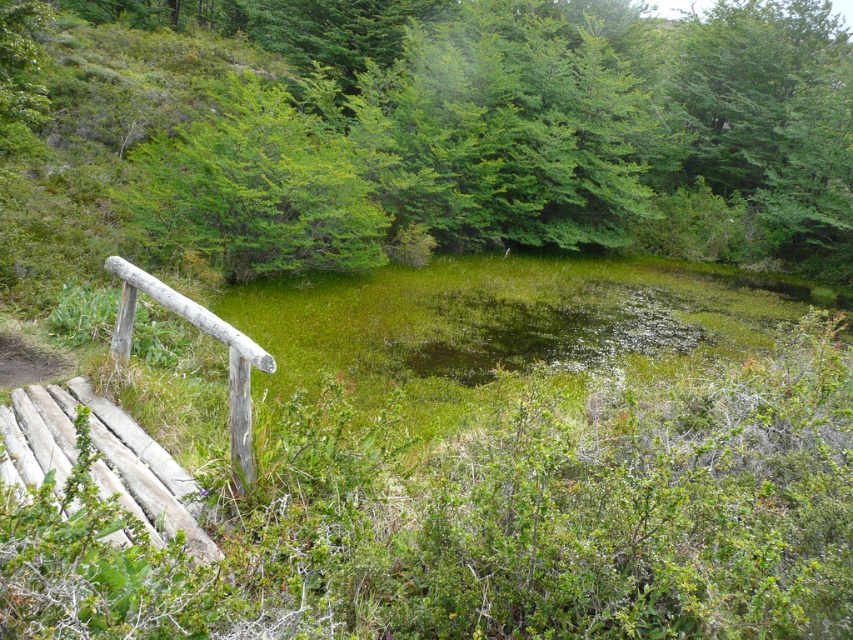
You are a hiker who wants to take a photo of the green leafy tree at upper center and the weathered wood rail at left. Which object should you focus on first if you want to capture both in a single frame without moving the camera?

The green leafy tree at upper center should be focused on first because it is larger in size compared to the weathered wood rail at left, ensuring it stands out in the photo.

You are standing at the center of the wooden bridge and want to locate the green leafy tree at upper center. According to the coordinates provided, in which direction should you look to find it?

The green leafy tree at upper center is located at coordinates point (x=256, y=189), which is slightly to the left of the center. Therefore, you should look to your left from the center of the wooden bridge to find it.

You are a hiker who needs to cross the wooden bridge but must ensure there is enough space between the green leafy tree at center and the weathered wood rail at left to safely pass through. Can you determine if the 60 feet wide equipment you have can fit through the space between them?

The distance between the green leafy tree at center and the weathered wood rail at left is 60.96 feet, so the 60 feet wide equipment can fit through the space between them since it is slightly wider than the equipment.